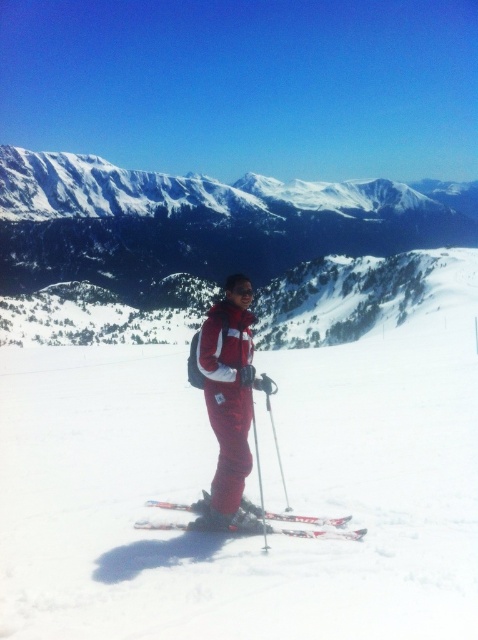
You are a photographer trying to capture the metallic skis at center in your shot. Based on their position, where should you focus your camera to ensure they are in the frame?

The metallic skis at center are located at point coordinates 0.817 on the x axis and 0.619 on the y axis, so you should focus your camera at that coordinate to ensure they are in the frame.

You are a photographer trying to capture the reflection of the black matte goggles at center in the white matte snow at center. Is this possible given their positions?

The white matte snow at center is below the black matte goggles at center, so the goggles are positioned higher than the snow. Since reflections typically occur on surfaces that are lower or at the same level as the object, the goggles would need to be at or below the snow level for their reflection to appear. Therefore, capturing the reflection might not be possible in this setup.